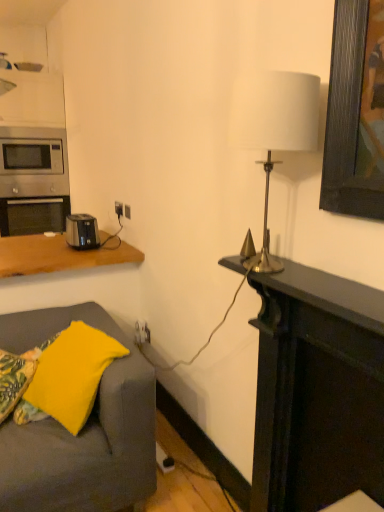
Where is `vacant space in front of black plastic toaster at left`? vacant space in front of black plastic toaster at left is located at coordinates (70, 249).